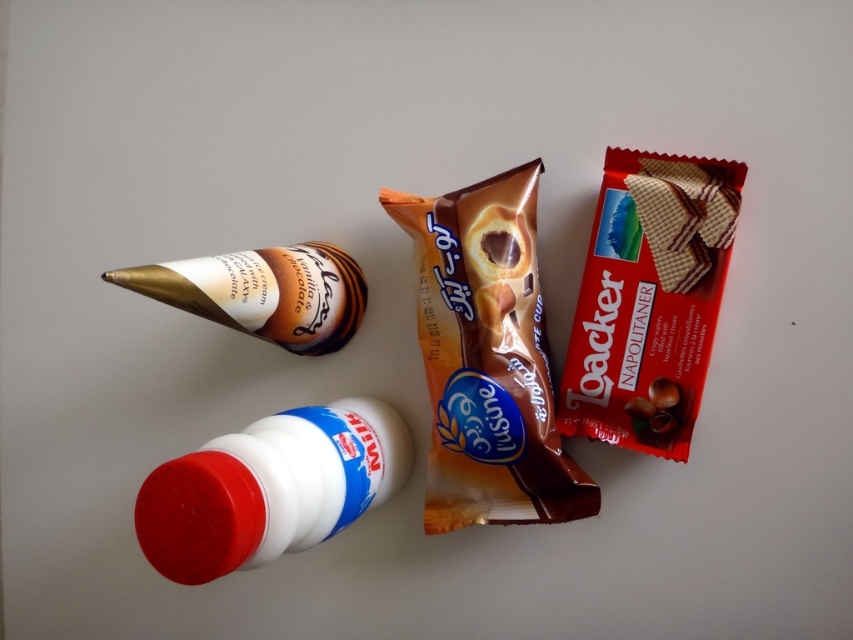
You are setting up a dessert table and have both the matte brown coffee cup at center and the matte chocolate wafer at center right. Which item would you place under a larger dessert plate to ensure stability?

The matte brown coffee cup at center is larger in size than the matte chocolate wafer at center right, so it would provide a more stable base under a larger dessert plate.

You are setting up a table for a coffee shop. You have a matte brown coffee cup at center and a gold foil cone at left. Which item should you place closer to the edge of the table to prevent it from tipping over?

The gold foil cone at left should be placed closer to the edge of the table because it is shorter than the matte brown coffee cup at center, making it less likely to tip over when positioned near the edge.